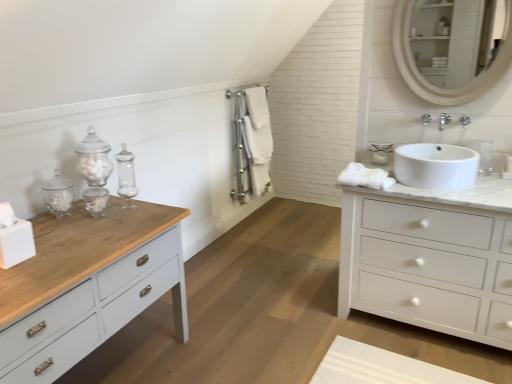
Question: Is white cotton bath towel at center, the third bath towel when ordered from right to left, bigger than white cotton towel at center, the 2th bath towel in the right-to-left sequence?

Choices:
 (A) yes
 (B) no

Answer: (A)

Question: Would you consider white cotton bath towel at center, which appears as the 2th bath towel when viewed from the back, to be distant from white cotton towel at center, which is the third bath towel in front-to-back order?

Choices:
 (A) yes
 (B) no

Answer: (B)

Question: From a real-world perspective, is white cotton bath towel at center, which appears as the 2th bath towel when viewed from the back, under white cotton towel at center, arranged as the second bath towel when viewed from the left?

Choices:
 (A) no
 (B) yes

Answer: (B)

Question: Is white cotton bath towel at center, marked as the 1th bath towel in a left-to-right arrangement, taller than white cotton towel at center, arranged as the second bath towel when viewed from the left?

Choices:
 (A) yes
 (B) no

Answer: (A)

Question: Is white cotton bath towel at center, the third bath towel when ordered from right to left, not inside white cotton towel at center, arranged as the second bath towel when viewed from the left?

Choices:
 (A) no
 (B) yes

Answer: (B)

Question: Visually, is white fluffy bath towel at right, which is the 1th bath towel from front to back, positioned to the left or to the right of white cotton bath towel at center, which appears as the 2th bath towel when viewed from the back?

Choices:
 (A) right
 (B) left

Answer: (A)

Question: Relative to white cotton bath towel at center, which appears as the 2th bath towel when viewed from the back, is white fluffy bath towel at right, which is counted as the 3th bath towel, starting from the back, in front or behind?

Choices:
 (A) behind
 (B) front

Answer: (B)

Question: Is white fluffy bath towel at right, the third bath towel viewed from the left, spatially inside white cotton bath towel at center, marked as the 1th bath towel in a left-to-right arrangement, or outside of it?

Choices:
 (A) outside
 (B) inside

Answer: (A)

Question: Is white fluffy bath towel at right, which is the 1th bath towel from front to back, taller or shorter than white cotton bath towel at center, which appears as the 2th bath towel when viewed from the back?

Choices:
 (A) tall
 (B) short

Answer: (B)

Question: From a real-world perspective, is white matte chest of drawers at right physically located above or below white fluffy bath towel at right, which is the 1th bath towel from front to back?

Choices:
 (A) below
 (B) above

Answer: (A)

Question: Do you think white matte chest of drawers at right is within white fluffy bath towel at right, acting as the 1th bath towel starting from the right, or outside of it?

Choices:
 (A) outside
 (B) inside

Answer: (A)

Question: Based on their sizes in the image, would you say white matte chest of drawers at right is bigger or smaller than white fluffy bath towel at right, which is counted as the 3th bath towel, starting from the back?

Choices:
 (A) small
 (B) big

Answer: (B)

Question: Considering the positions of white matte chest of drawers at right and white fluffy bath towel at right, which is counted as the 3th bath towel, starting from the back, in the image, is white matte chest of drawers at right wider or thinner than white fluffy bath towel at right, which is counted as the 3th bath towel, starting from the back,?

Choices:
 (A) wide
 (B) thin

Answer: (A)

Question: Considering the positions of white cotton towel at center, which is the third bath towel in front-to-back order, and white glossy sink at right in the image, is white cotton towel at center, which is the third bath towel in front-to-back order, bigger or smaller than white glossy sink at right?

Choices:
 (A) small
 (B) big

Answer: (A)

Question: Relative to white glossy sink at right, is white cotton towel at center, which is the third bath towel in front-to-back order, in front or behind?

Choices:
 (A) front
 (B) behind

Answer: (B)